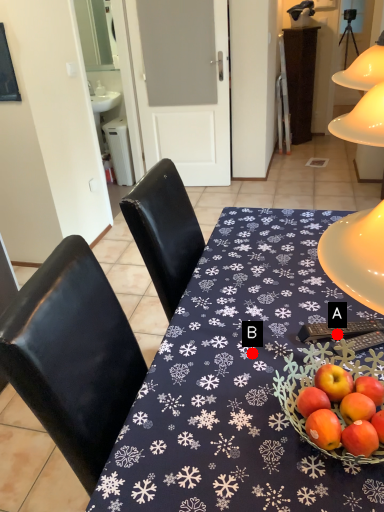
Question: Two points are circled on the image, labeled by A and B beside each circle. Which point appears closest to the camera in this image?

Choices:
 (A) A is closer
 (B) B is closer

Answer: (B)